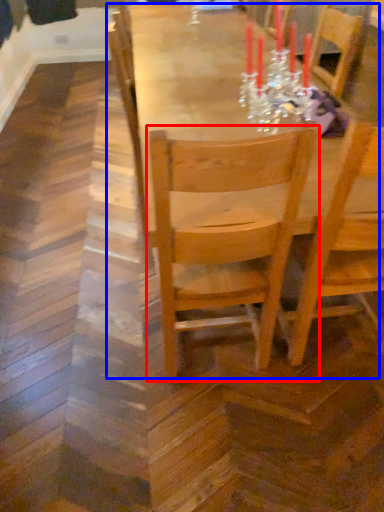
Question: Which of the following is the farthest to the observer, chair (highlighted by a red box) or table (highlighted by a blue box)?

Choices:
 (A) chair
 (B) table

Answer: (B)